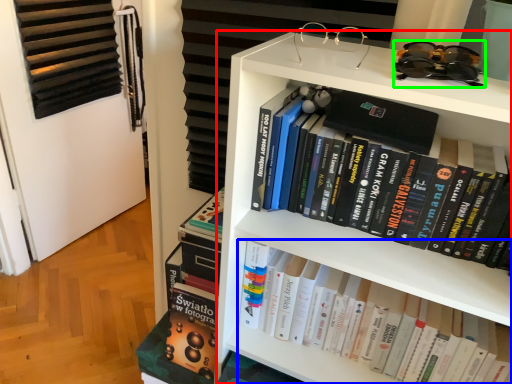
Question: Which object is positioned closest to bookcase (highlighted by a red box)? Select from book (highlighted by a blue box) and glasses (highlighted by a green box).

Choices:
 (A) book
 (B) glasses

Answer: (A)